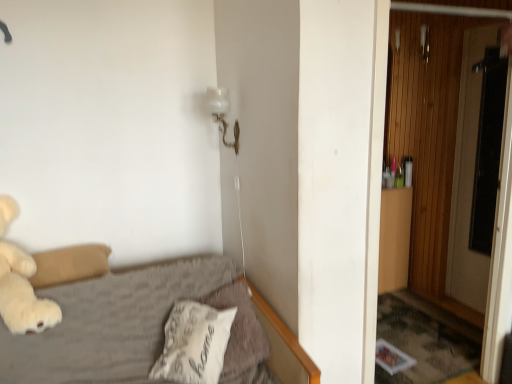
How much space does white soft pillow at lower center, which appears as the second pillow when viewed from the left, occupy horizontally?

14.77 inches.

I want to click on white soft pillow at lower center, the 1th pillow when ordered from left to right, so click(194, 343).

Identify the location of transparent glass screen door at right. (468, 178).

Locate an element on the screen. The image size is (512, 384). white plush teddy bear at left is located at coordinates (23, 294).

Measure the distance between point (220, 106) and camera.

The distance of point (220, 106) from camera is 2.24 meters.

Where is `white soft pillow at lower center, which is the 1th pillow from right to left`? This screenshot has width=512, height=384. white soft pillow at lower center, which is the 1th pillow from right to left is located at coordinates (240, 328).

In terms of size, does white soft pillow at lower center, which appears as the second pillow when viewed from the left, appear bigger or smaller than transparent glass screen door at right?

In the image, white soft pillow at lower center, which appears as the second pillow when viewed from the left, appears to be smaller than transparent glass screen door at right.

Is white soft pillow at lower center, which appears as the second pillow when viewed from the left, oriented away from transparent glass screen door at right?

That's not correct — white soft pillow at lower center, which appears as the second pillow when viewed from the left, is not looking away from transparent glass screen door at right.

Would you say white soft pillow at lower center, which is the 1th pillow from right to left, is inside or outside transparent glass screen door at right?

white soft pillow at lower center, which is the 1th pillow from right to left, is spatially situated outside transparent glass screen door at right.

Is point (227, 344) closer to camera compared to point (223, 138)?

Yes.

From a real-world perspective, which object rests below the other?

From a 3D spatial view, white soft pillow at lower center, the 2th pillow from the right, is below.

From the picture: Between white soft pillow at lower center, the 1th pillow when ordered from left to right, and white glass lamp at upper center, which one has less height?

white soft pillow at lower center, the 1th pillow when ordered from left to right, is shorter.

Considering the relative positions of white soft pillow at lower center, the 2th pillow from the right, and white glass lamp at upper center in the image provided, is white soft pillow at lower center, the 2th pillow from the right, to the right of white glass lamp at upper center from the viewer's perspective?

No.

Consider the image. How many degrees apart are the facing directions of white glass lamp at upper center and wooden at right?

There is a 87.4-degree angle between the facing directions of white glass lamp at upper center and wooden at right.

Does white glass lamp at upper center have a lesser height compared to wooden at right?

Yes.

In the scene shown: From the image's perspective, which one is positioned lower, white glass lamp at upper center or wooden at right?

wooden at right, from the image's perspective.

Is white glass lamp at upper center far away from wooden at right?

Yes.

Would you say wooden at right is part of white soft pillow at lower center, the 1th pillow when ordered from left to right,'s contents?

No, wooden at right is not surrounded by white soft pillow at lower center, the 1th pillow when ordered from left to right.

Is wooden at right at the back of white soft pillow at lower center, the 2th pillow from the right?

No, white soft pillow at lower center, the 2th pillow from the right,'s orientation is not away from wooden at right.

From the image's perspective, is white soft pillow at lower center, the 2th pillow from the right, located above or below wooden at right?

Based on their image positions, white soft pillow at lower center, the 2th pillow from the right, is located beneath wooden at right.

In terms of height, does white soft pillow at lower center, the 1th pillow when ordered from left to right, look taller or shorter compared to wooden at right?

white soft pillow at lower center, the 1th pillow when ordered from left to right, is shorter than wooden at right.

Is white plush teddy bear at left facing towards white soft pillow at lower center, the 2th pillow from the right?

No.

Which of these two, white plush teddy bear at left or white soft pillow at lower center, the 2th pillow from the right, stands taller?

Standing taller between the two is white plush teddy bear at left.

Between white plush teddy bear at left and white soft pillow at lower center, the 2th pillow from the right, which one has smaller size?

white soft pillow at lower center, the 2th pillow from the right.

Based on the photo, from the image's perspective, which is above, white plush teddy bear at left or white soft pillow at lower center, the 2th pillow from the right?

white plush teddy bear at left appears higher in the image.

Can you tell me how much wooden at right and white plush teddy bear at left differ in facing direction?

0.346 degrees.

From the image's perspective, which is above, wooden at right or white plush teddy bear at left?

From the image's view, wooden at right is above.

Looking at this image, is wooden at right inside the boundaries of white plush teddy bear at left, or outside?

wooden at right is located beyond the bounds of white plush teddy bear at left.

Which of these two, wooden at right or white plush teddy bear at left, is thinner?

Thinner between the two is wooden at right.

In the scene shown: Measure the distance between transparent glass screen door at right and wooden at right.

transparent glass screen door at right and wooden at right are 8.39 inches apart.

Between point (462, 167) and point (434, 67), which one is positioned in front?

Positioned in front is point (434, 67).

What's the angular difference between transparent glass screen door at right and wooden at right's facing directions?

There is a 84.9-degree angle between the facing directions of transparent glass screen door at right and wooden at right.

Is transparent glass screen door at right surrounding wooden at right?

That's incorrect, wooden at right is not inside transparent glass screen door at right.

Identify the location of screen door behind the white soft pillow at lower center, which appears as the second pillow when viewed from the left. (468, 178).

This screenshot has height=384, width=512. In order to click on the 1st pillow positioned below the white glass lamp at upper center (from a real-world perspective) in this screenshot , I will do `click(194, 343)`.

Which object lies nearer to the anchor point white plush teddy bear at left, white glass lamp at upper center or white soft pillow at lower center, which is the 1th pillow from right to left?

white soft pillow at lower center, which is the 1th pillow from right to left.

Which object lies nearer to the anchor point white plush teddy bear at left, white soft pillow at lower center, the 2th pillow from the right, or white soft pillow at lower center, which is the 1th pillow from right to left?

Among the two, white soft pillow at lower center, the 2th pillow from the right, is located nearer to white plush teddy bear at left.

Considering their positions, is wooden at right positioned closer to white soft pillow at lower center, which appears as the second pillow when viewed from the left, than transparent glass screen door at right?

Based on the image, wooden at right appears to be nearer to white soft pillow at lower center, which appears as the second pillow when viewed from the left.

Which object lies nearer to the anchor point white soft pillow at lower center, the 1th pillow when ordered from left to right, white glass lamp at upper center or white plush teddy bear at left?

Among the two, white plush teddy bear at left is located nearer to white soft pillow at lower center, the 1th pillow when ordered from left to right.

From the image, which object appears to be nearer to white soft pillow at lower center, the 2th pillow from the right, wooden at right or white soft pillow at lower center, which is the 1th pillow from right to left?

white soft pillow at lower center, which is the 1th pillow from right to left, is positioned closer to the anchor white soft pillow at lower center, the 2th pillow from the right.

Consider the image. Which object lies further to the anchor point wooden at right, white glass lamp at upper center or white plush teddy bear at left?

The object further to wooden at right is white plush teddy bear at left.

Considering their positions, is wooden at right positioned further to white plush teddy bear at left than white soft pillow at lower center, the 2th pillow from the right?

wooden at right.

From the image, which object appears to be nearer to white plush teddy bear at left, wooden at right or white soft pillow at lower center, which is the 1th pillow from right to left?

white soft pillow at lower center, which is the 1th pillow from right to left.

The height and width of the screenshot is (384, 512). I want to click on lamp located between white soft pillow at lower center, the 2th pillow from the right, and transparent glass screen door at right in the left-right direction, so click(222, 114).

At what (x,y) coordinates should I click in order to perform the action: click on door situated between white soft pillow at lower center, the 2th pillow from the right, and transparent glass screen door at right from left to right. Please return your answer as a coordinate pair (x, y). Image resolution: width=512 pixels, height=384 pixels. Looking at the image, I should click on (428, 138).

The height and width of the screenshot is (384, 512). I want to click on pillow between white glass lamp at upper center and wooden at right, so click(240, 328).

Identify the location of pillow between white glass lamp at upper center and white soft pillow at lower center, the 2th pillow from the right, in the up-down direction. (240, 328).